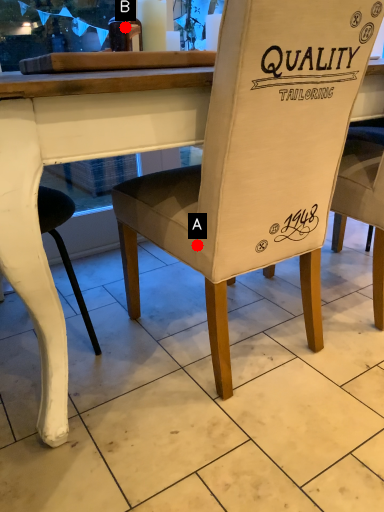
Question: Two points are circled on the image, labeled by A and B beside each circle. Which point is further to the camera?

Choices:
 (A) A is further
 (B) B is further

Answer: (B)